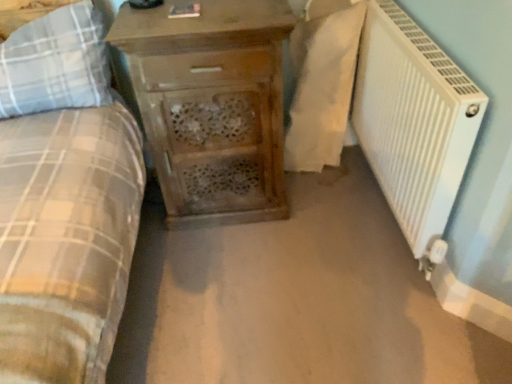
Locate an element on the screen. vacant area that is situated to the right of wooden chest of drawers at center is located at coordinates (328, 217).